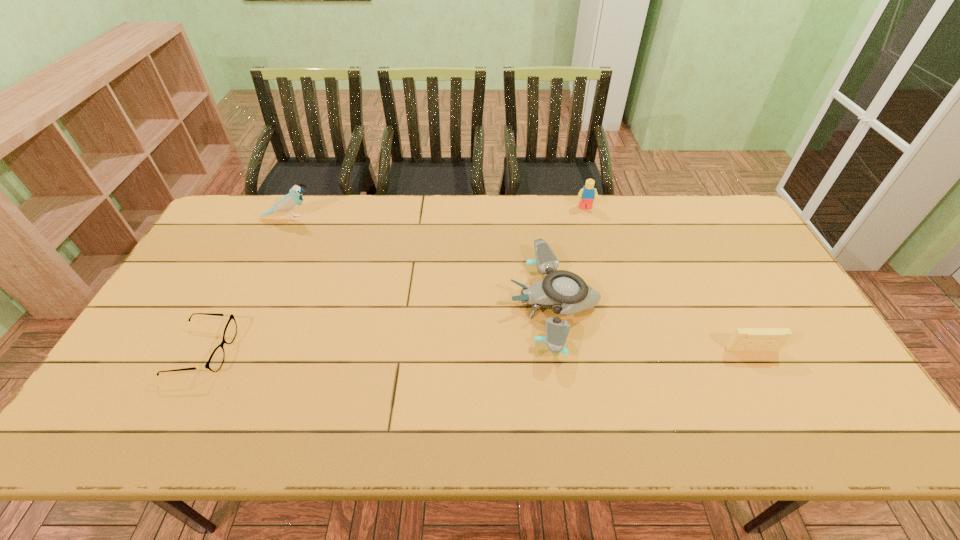
Identify the location of free space located 0.320m on the front-facing side of the drone. Image resolution: width=960 pixels, height=540 pixels. click(397, 304).

I want to click on free location located 0.340m on the front-facing side of the drone, so click(390, 304).

Where is `free space located 0.140m at the front of the rightmost object with spools`? This screenshot has height=540, width=960. free space located 0.140m at the front of the rightmost object with spools is located at coordinates (780, 402).

Locate an element on the screen. free space located on the front-facing side of the spectacles is located at coordinates (314, 352).

Where is `bird located in the far edge section of the desktop`? This screenshot has width=960, height=540. bird located in the far edge section of the desktop is located at coordinates (290, 202).

Where is `Lego at the far edge`? The width and height of the screenshot is (960, 540). Lego at the far edge is located at coordinates tap(587, 194).

The image size is (960, 540). In order to click on bird present at the left edge in this screenshot , I will do `click(290, 202)`.

Locate an element on the screen. spectacles present at the left edge is located at coordinates (216, 359).

Locate an element on the screen. The width and height of the screenshot is (960, 540). object situated at the right edge is located at coordinates (743, 339).

Where is `object located in the far left corner section of the desktop`? Image resolution: width=960 pixels, height=540 pixels. object located in the far left corner section of the desktop is located at coordinates pyautogui.click(x=290, y=202).